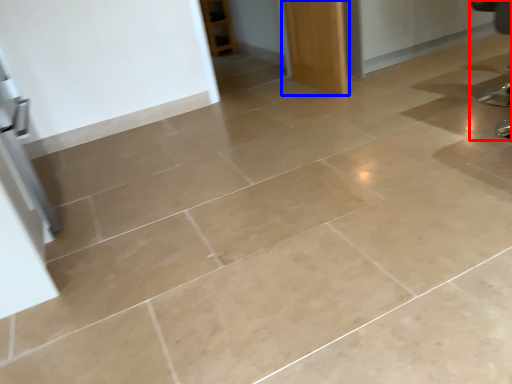
Question: Which object is closer to the camera taking this photo, swivel chair (highlighted by a red box) or door (highlighted by a blue box)?

Choices:
 (A) swivel chair
 (B) door

Answer: (A)